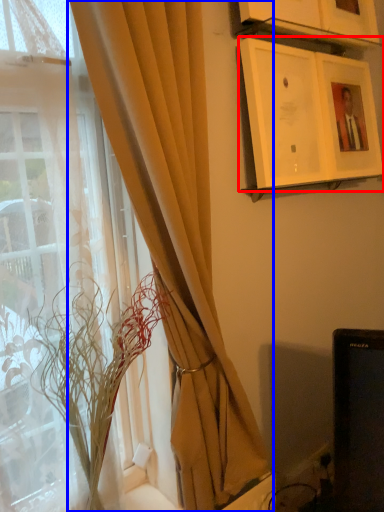
Question: Which of the following is the closest to the observer, picture frame (highlighted by a red box) or curtain (highlighted by a blue box)?

Choices:
 (A) picture frame
 (B) curtain

Answer: (B)